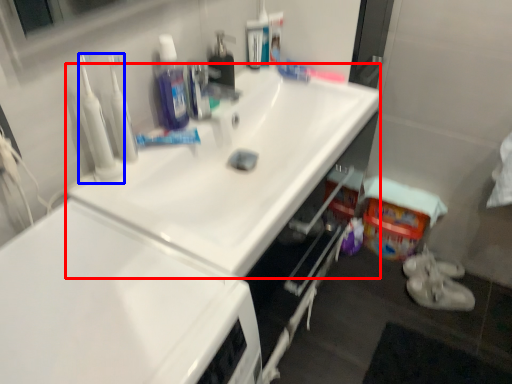
Question: Which object is closer to the camera taking this photo, sink (highlighted by a red box) or cleanser (highlighted by a blue box)?

Choices:
 (A) sink
 (B) cleanser

Answer: (A)